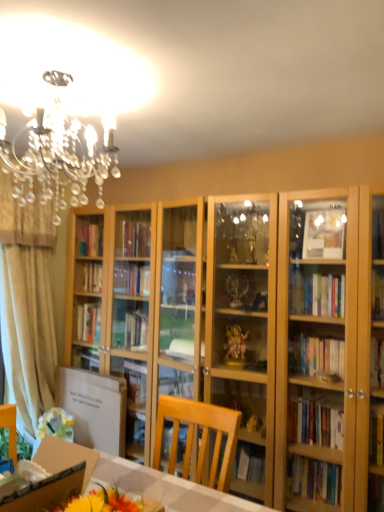
Measure the distance between point (x=57, y=443) and camera.

Point (x=57, y=443) is 1.60 meters from camera.

I want to click on white cardboard box at lower left, so click(54, 477).

Which object is positioned more to the left, beige fabric curtain at left or wooden desk at lower left?

beige fabric curtain at left.

Is point (7, 365) farther from viewer compared to point (180, 489)?

Yes, point (7, 365) is behind point (180, 489).

Based on the photo, does beige fabric curtain at left turn towards wooden desk at lower left?

No, beige fabric curtain at left is not turned towards wooden desk at lower left.

Between beige fabric curtain at left and wooden desk at lower left, which one has smaller size?

wooden desk at lower left is smaller.

Considering the sizes of objects wooden desk at lower left and white cardboard box at lower left in the image provided, who is taller, wooden desk at lower left or white cardboard box at lower left?

Standing taller between the two is white cardboard box at lower left.

Which of these two, wooden desk at lower left or white cardboard box at lower left, is wider?

white cardboard box at lower left.

In the scene shown: From a real-world perspective, is wooden desk at lower left physically located above or below white cardboard box at lower left?

In terms of real-world spatial position, wooden desk at lower left is below white cardboard box at lower left.

Visually, is wooden desk at lower left positioned to the left or to the right of white cardboard box at lower left?

Clearly, wooden desk at lower left is on the right of white cardboard box at lower left in the image.

Is white cardboard box at lower left far from wooden desk at lower left?

white cardboard box at lower left is near wooden desk at lower left, not far away.

Which is correct: white cardboard box at lower left is inside wooden desk at lower left, or outside of it?

white cardboard box at lower left is spatially situated outside wooden desk at lower left.

Between white cardboard box at lower left and wooden desk at lower left, which one has less height?

Standing shorter between the two is wooden desk at lower left.

From the picture: Is wooden desk at lower left wider or thinner than beige fabric curtain at left?

Clearly, wooden desk at lower left has more width compared to beige fabric curtain at left.

Can you confirm if wooden desk at lower left is positioned to the left of beige fabric curtain at left?

In fact, wooden desk at lower left is to the right of beige fabric curtain at left.

Is wooden desk at lower left positioned before beige fabric curtain at left?

That is True.

What are the coordinates of `curtain behind the wooden desk at lower left` in the screenshot? It's located at (27, 306).

Does point (27, 228) come closer to viewer compared to point (58, 482)?

No, it is not.

Looking at this image, between beige fabric curtain at left and white cardboard box at lower left, which one has more height?

With more height is beige fabric curtain at left.

Is beige fabric curtain at left at the right side of white cardboard box at lower left?

Incorrect, beige fabric curtain at left is not on the right side of white cardboard box at lower left.

From a real-world perspective, which object rests below the other?

white cardboard box at lower left.

Does white cardboard box at lower left have a lesser width compared to beige fabric curtain at left?

No.

At what (x,y) coordinates should I click in order to perform the action: click on cardboard box located underneath the beige fabric curtain at left (from a real-world perspective). Please return your answer as a coordinate pair (x, y). The width and height of the screenshot is (384, 512). Looking at the image, I should click on (54, 477).

Consider the image. From a real-world perspective, is white cardboard box at lower left physically located above or below beige fabric curtain at left?

Clearly, from a real-world perspective, white cardboard box at lower left is below beige fabric curtain at left.

From the picture: Who is shorter, white cardboard box at lower left or beige fabric curtain at left?

Standing shorter between the two is white cardboard box at lower left.

Identify the location of curtain behind the wooden desk at lower left. Image resolution: width=384 pixels, height=512 pixels. (27, 306).

The height and width of the screenshot is (512, 384). Find the location of `desk below the white cardboard box at lower left (from the image's perspective)`. desk below the white cardboard box at lower left (from the image's perspective) is located at coordinates (139, 479).

In the scene shown: Based on their spatial positions, is wooden desk at lower left or beige fabric curtain at left closer to white cardboard box at lower left?

wooden desk at lower left is closer to white cardboard box at lower left.

Which object lies further to the anchor point beige fabric curtain at left, wooden desk at lower left or white cardboard box at lower left?

white cardboard box at lower left.

Estimate the real-world distances between objects in this image. Which object is closer to wooden desk at lower left, white cardboard box at lower left or beige fabric curtain at left?

Based on the image, white cardboard box at lower left appears to be nearer to wooden desk at lower left.

Based on their spatial positions, is beige fabric curtain at left or white cardboard box at lower left closer to wooden desk at lower left?

The object closer to wooden desk at lower left is white cardboard box at lower left.

Which object lies further to the anchor point beige fabric curtain at left, white cardboard box at lower left or wooden desk at lower left?

white cardboard box at lower left.

Based on their spatial positions, is beige fabric curtain at left or wooden desk at lower left closer to white cardboard box at lower left?

wooden desk at lower left lies closer to white cardboard box at lower left than the other object.

This screenshot has width=384, height=512. What are the coordinates of `cardboard box between wooden desk at lower left and beige fabric curtain at left in the front-back direction` in the screenshot? It's located at (54, 477).